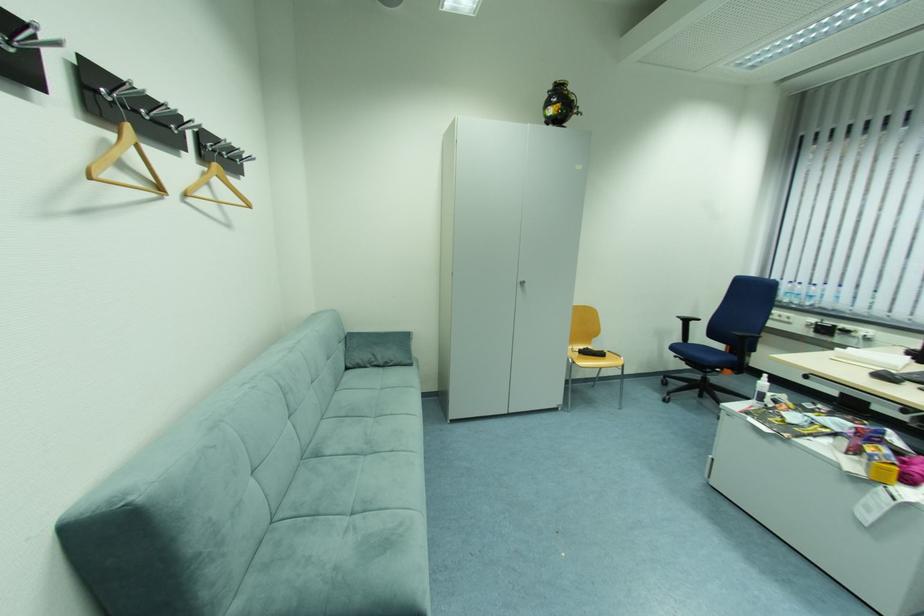
Identify the location of chair armrest. This screenshot has height=616, width=924. (687, 326).